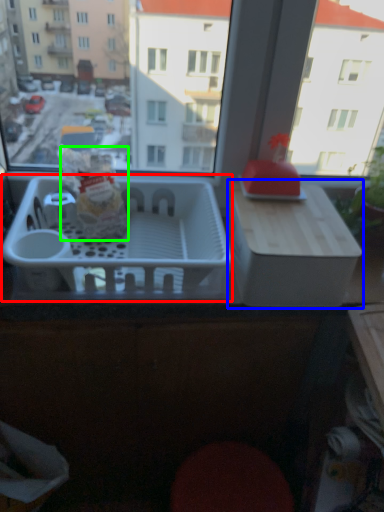
Question: Estimate the real-world distances between objects in this image. Which object is farther from basket (highlighted by a red box), cardboard box (highlighted by a blue box) or snack (highlighted by a green box)?

Choices:
 (A) cardboard box
 (B) snack

Answer: (A)